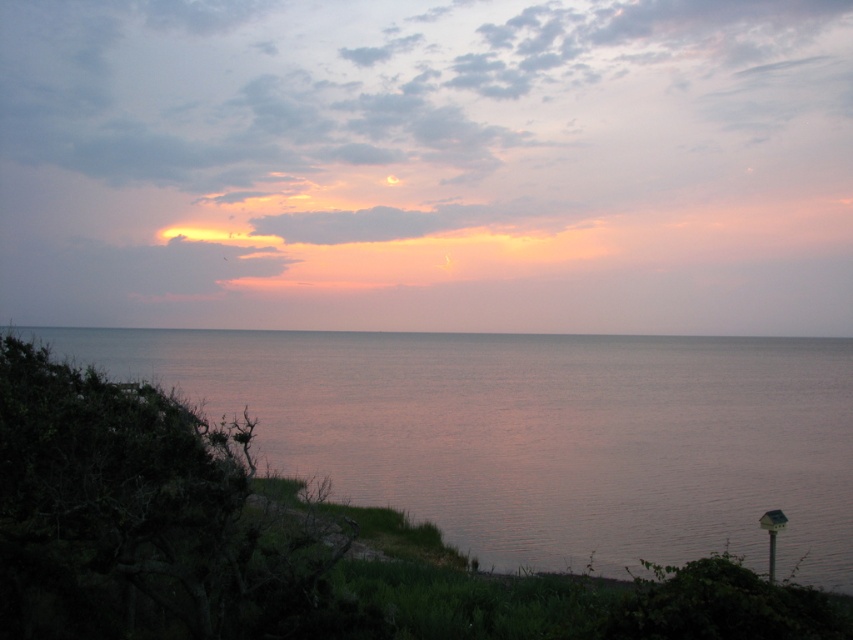
Question: Can you confirm if pastel pink cloud at upper center is positioned to the left of gray matte horizon at center?

Choices:
 (A) no
 (B) yes

Answer: (B)

Question: Can you confirm if pastel pink cloud at upper center is bigger than gray matte horizon at center?

Choices:
 (A) yes
 (B) no

Answer: (A)

Question: Which of the following is the farthest from the observer?

Choices:
 (A) smooth water at lower left
 (B) pastel pink cloud at upper center

Answer: (B)

Question: Which object is farther from the camera taking this photo?

Choices:
 (A) gray matte horizon at center
 (B) pastel pink cloud at upper center
 (C) smooth water at lower left

Answer: (B)

Question: Which point is farther from the camera taking this photo?

Choices:
 (A) (271, 93)
 (B) (303, 417)

Answer: (A)

Question: Is pastel pink cloud at upper center to the right of smooth water at lower left from the viewer's perspective?

Choices:
 (A) yes
 (B) no

Answer: (B)